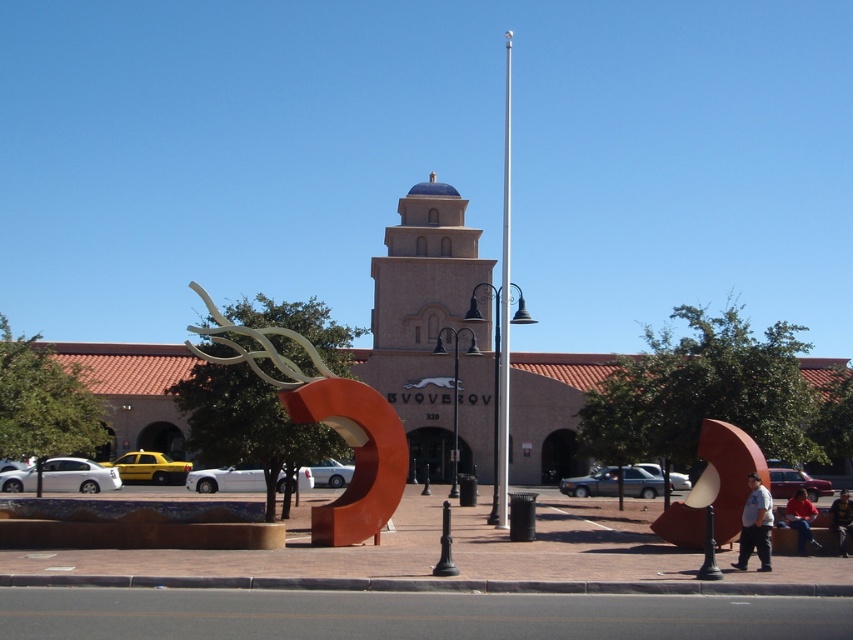
Question: Does beige stucco bell tower at center come in front of dark blue shirt at lower right?

Choices:
 (A) yes
 (B) no

Answer: (B)

Question: Which point is farther to the camera?

Choices:
 (A) (402, 372)
 (B) (769, 493)
 (C) (206, 298)
 (D) (799, 497)

Answer: (A)

Question: Does beige stucco bell tower at center have a greater width compared to light blue shirt at center?

Choices:
 (A) no
 (B) yes

Answer: (B)

Question: Does beige stucco bell tower at center come behind silver metallic flag pole at center?

Choices:
 (A) yes
 (B) no

Answer: (A)

Question: Which point is closer to the camera?

Choices:
 (A) (434, 205)
 (B) (381, 470)
 (C) (833, 516)

Answer: (C)

Question: Which of the following is the closest to the observer?

Choices:
 (A) denim jacket at lower right
 (B) silver metallic flag pole at center

Answer: (A)